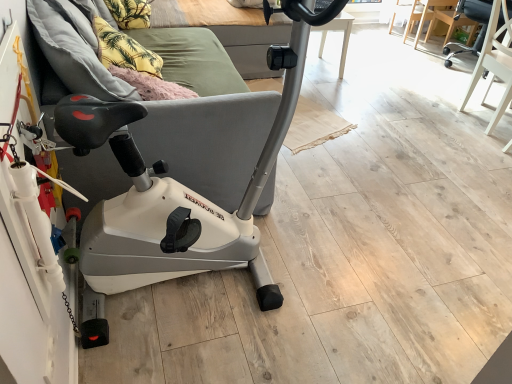
Image resolution: width=512 pixels, height=384 pixels. What are the coordinates of `free space that is in between white plastic stationary bicycle at left and black leather swivel chair at upper right, acting as the second swivel chair starting from the front` in the screenshot? It's located at (384, 139).